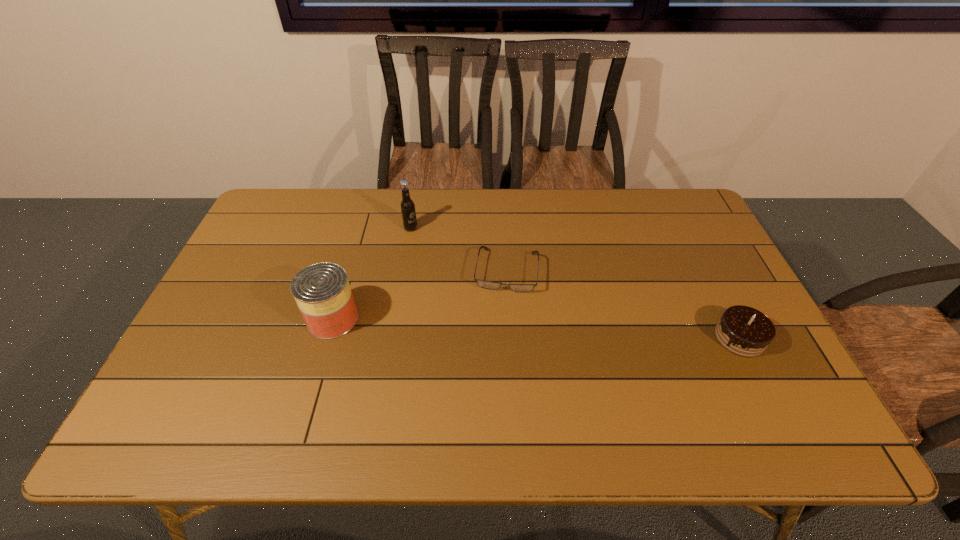
Where is `vacant area situated 0.320m on the front-facing side of the second farthest object`? vacant area situated 0.320m on the front-facing side of the second farthest object is located at coordinates (491, 398).

Identify the location of free space located on the front-facing side of the second farthest object. (497, 341).

Image resolution: width=960 pixels, height=540 pixels. In order to click on vacant space situated 0.270m on the front-facing side of the second farthest object in this screenshot , I will do `click(492, 379)`.

At what (x,y) coordinates should I click in order to perform the action: click on blank area located 0.090m on the label of the root beer. Please return your answer as a coordinate pair (x, y). The height and width of the screenshot is (540, 960). Looking at the image, I should click on (436, 242).

At what (x,y) coordinates should I click in order to perform the action: click on free space located on the label of the root beer. Please return your answer as a coordinate pair (x, y). The height and width of the screenshot is (540, 960). Looking at the image, I should click on (516, 288).

Locate an element on the screen. free space located 0.190m on the label of the root beer is located at coordinates (460, 256).

Identify the location of object at the far edge. The width and height of the screenshot is (960, 540). (407, 206).

The height and width of the screenshot is (540, 960). What are the coordinates of `object at the right edge` in the screenshot? It's located at (744, 331).

Find the location of a particular element. This screenshot has height=540, width=960. vacant space at the far edge is located at coordinates (484, 208).

The height and width of the screenshot is (540, 960). In order to click on free space at the left edge of the desktop in this screenshot , I will do `click(268, 248)`.